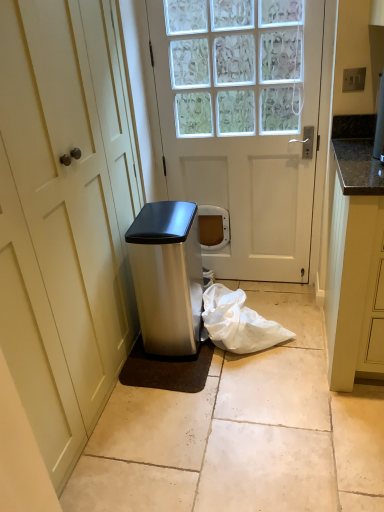
Question: From the image's perspective, is white matte door at center, the 2th door from the right, on satin silver trash can at lower left?

Choices:
 (A) yes
 (B) no

Answer: (A)

Question: Can you confirm if white matte door at center, the 1th door when ordered from left to right, is smaller than satin silver trash can at lower left?

Choices:
 (A) yes
 (B) no

Answer: (B)

Question: Is white matte door at center, the 1th door when ordered from left to right, at the left side of satin silver trash can at lower left?

Choices:
 (A) no
 (B) yes

Answer: (B)

Question: Are white matte door at center, the 2th door from the right, and satin silver trash can at lower left far apart?

Choices:
 (A) yes
 (B) no

Answer: (B)

Question: From the image's perspective, is white matte door at center, the 2th door from the right, located beneath satin silver trash can at lower left?

Choices:
 (A) yes
 (B) no

Answer: (B)

Question: Looking at their shapes, would you say satin silver trash can at lower left is wider or thinner than white matte door at center, which is counted as the 1th door, starting from the right?

Choices:
 (A) thin
 (B) wide

Answer: (B)

Question: From the image's perspective, is satin silver trash can at lower left located above or below white matte door at center, positioned as the second door in left-to-right order?

Choices:
 (A) above
 (B) below

Answer: (B)

Question: In terms of height, does satin silver trash can at lower left look taller or shorter compared to white matte door at center, positioned as the second door in left-to-right order?

Choices:
 (A) tall
 (B) short

Answer: (B)

Question: Is point (198, 279) closer or farther from the camera than point (205, 64)?

Choices:
 (A) farther
 (B) closer

Answer: (B)

Question: Is white matte door at center, which is counted as the 1th door, starting from the right, situated inside granite countertop at right or outside?

Choices:
 (A) inside
 (B) outside

Answer: (B)

Question: In the image, is white matte door at center, which is counted as the 1th door, starting from the right, positioned in front of or behind granite countertop at right?

Choices:
 (A) behind
 (B) front

Answer: (A)

Question: Based on their sizes in the image, would you say white matte door at center, which is counted as the 1th door, starting from the right, is bigger or smaller than granite countertop at right?

Choices:
 (A) big
 (B) small

Answer: (B)

Question: From the image's perspective, is white matte door at center, positioned as the second door in left-to-right order, located above or below granite countertop at right?

Choices:
 (A) above
 (B) below

Answer: (A)

Question: In terms of height, does white matte door at center, positioned as the second door in left-to-right order, look taller or shorter compared to white matte door at center, the 2th door from the right?

Choices:
 (A) short
 (B) tall

Answer: (A)

Question: Looking at their shapes, would you say white matte door at center, which is counted as the 1th door, starting from the right, is wider or thinner than white matte door at center, the 1th door when ordered from left to right?

Choices:
 (A) wide
 (B) thin

Answer: (B)